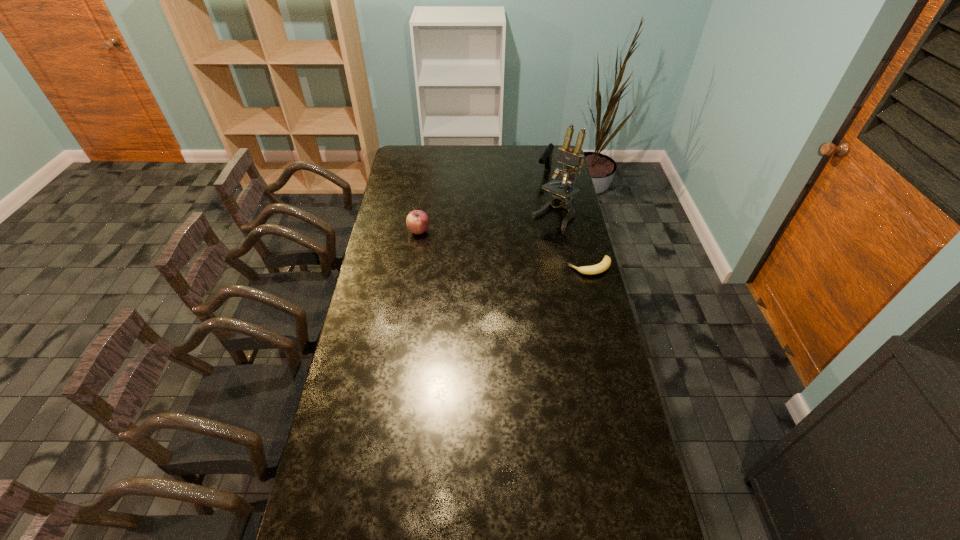
At what (x,y) coordinates should I click in order to perform the action: click on apple. Please return your answer as a coordinate pair (x, y). The image size is (960, 540). Looking at the image, I should click on (417, 221).

Where is `the leftmost object`? the leftmost object is located at coordinates (417, 221).

This screenshot has width=960, height=540. Identify the location of banana. (606, 262).

Find the location of a particular element. The height and width of the screenshot is (540, 960). the shortest object is located at coordinates (606, 262).

In order to click on the farthest object in this screenshot , I will do `click(546, 158)`.

Find the location of `pistol`. pistol is located at coordinates (546, 158).

Identify the location of microscope. (571, 158).

At what (x,y) coordinates should I click in order to perform the action: click on free space located 0.240m on the right of the apple. Please return your answer as a coordinate pair (x, y). The width and height of the screenshot is (960, 540). Looking at the image, I should click on (483, 231).

Find the location of `vacant space situated 0.150m on the left of the shortest object`. vacant space situated 0.150m on the left of the shortest object is located at coordinates (532, 267).

At what (x,y) coordinates should I click in order to perform the action: click on free spot located 0.070m at the barrel of the pistol. Please return your answer as a coordinate pair (x, y). Looking at the image, I should click on (538, 189).